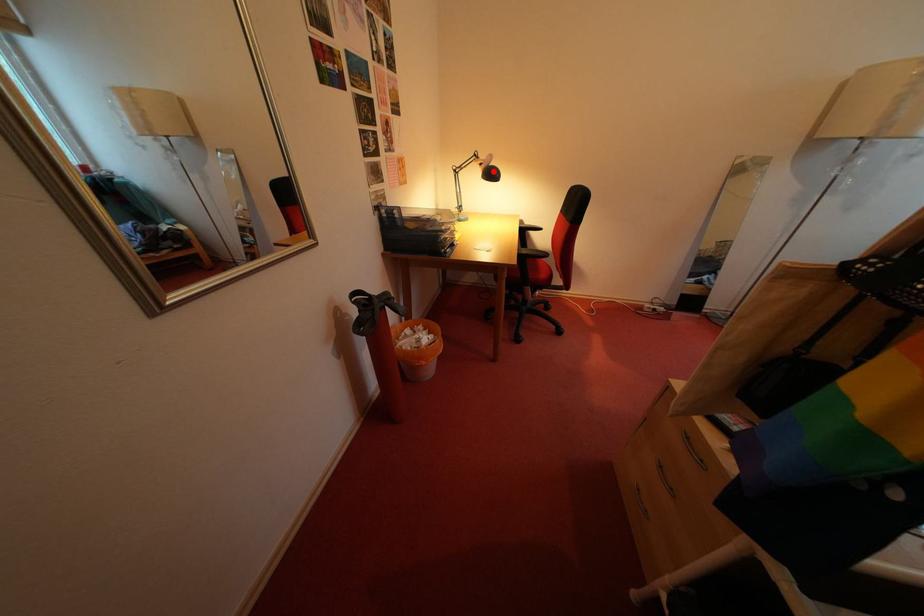
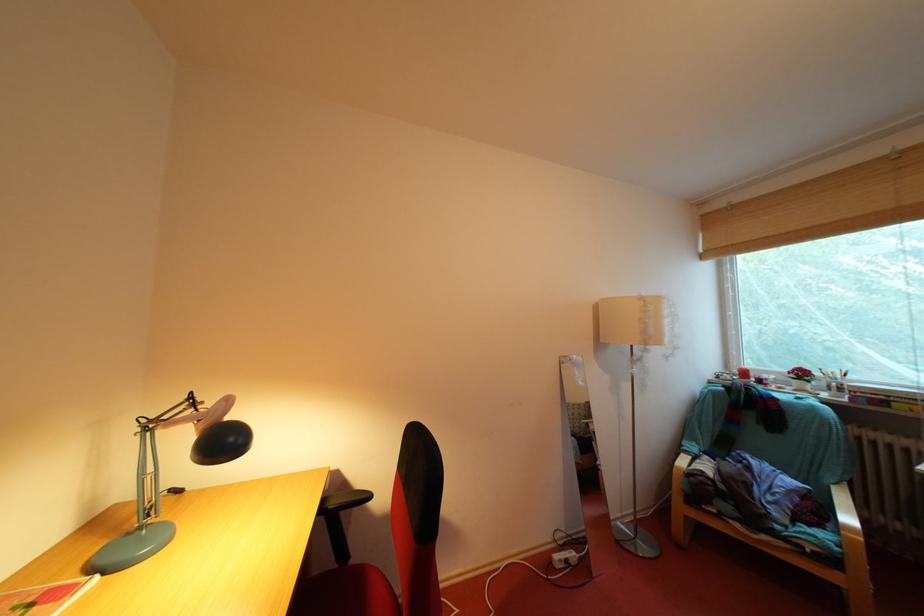
Question: A red point is marked in image1. In image2, is the corresponding 3D point closer to the camera or farther? Reply with the corresponding letter.

Choices:
 (A) The corresponding 3D point is closer.
 (B) The corresponding 3D point is farther.

Answer: (B)